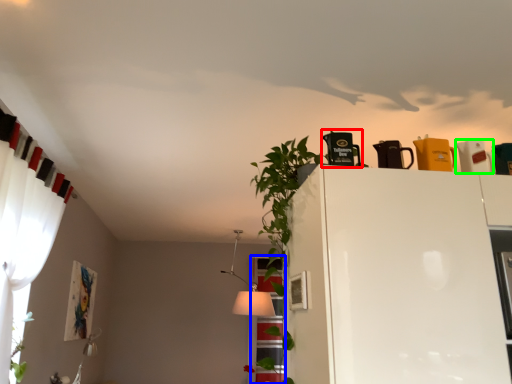
Question: Which object is positioned farthest from appliance (highlighted by a red box)? Select from window (highlighted by a blue box) and appliance (highlighted by a green box).

Choices:
 (A) window
 (B) appliance

Answer: (A)